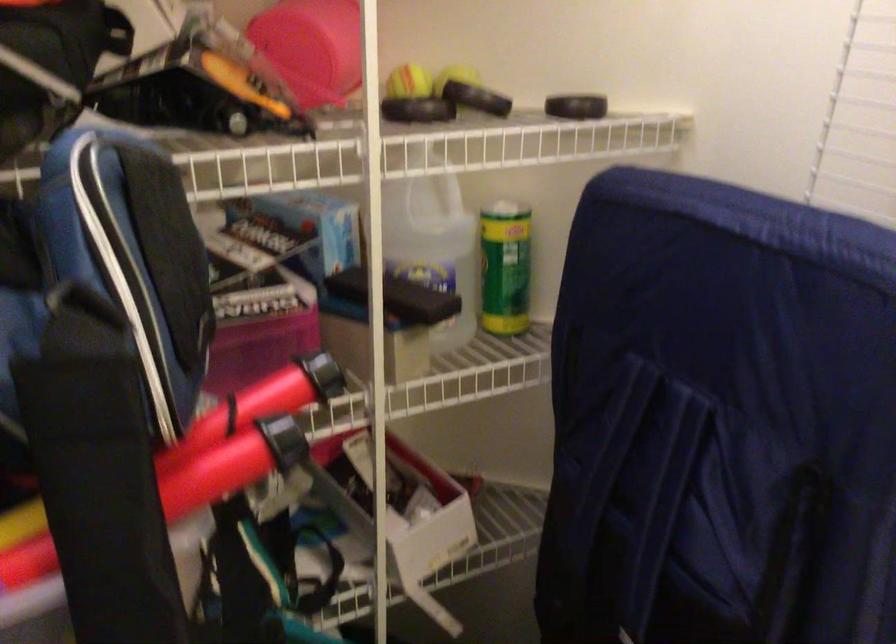
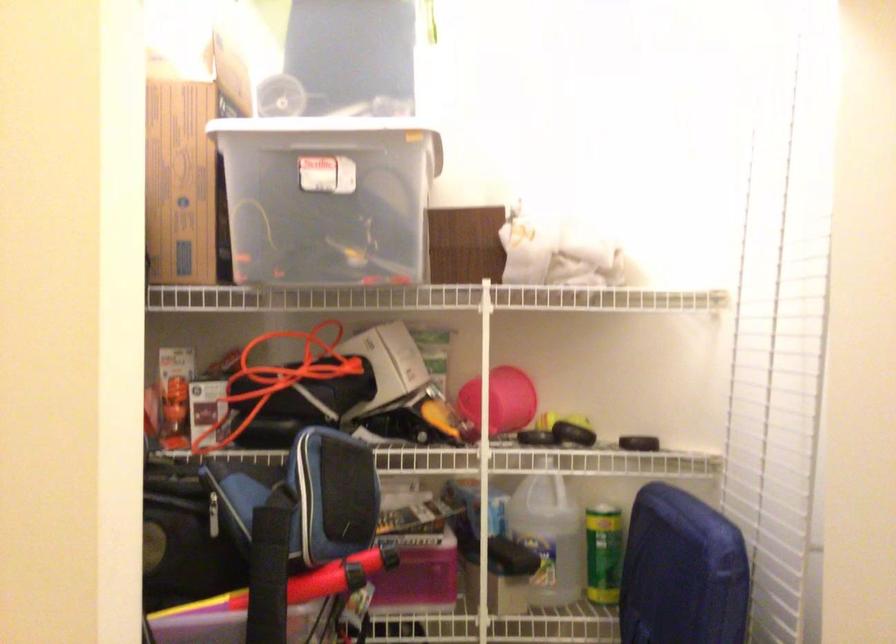
In the second image, find the point that corresponds to (448,257) in the first image.

(548, 536)